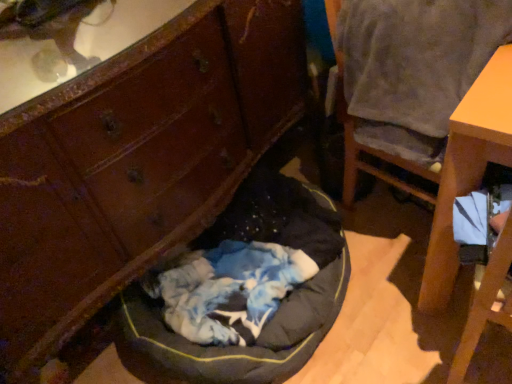
Question: Considering the relative sizes of dark gray fabric dog bed at center and wooden dresser at lower left in the image provided, is dark gray fabric dog bed at center thinner than wooden dresser at lower left?

Choices:
 (A) no
 (B) yes

Answer: (A)

Question: Can you confirm if dark gray fabric dog bed at center is bigger than wooden dresser at lower left?

Choices:
 (A) no
 (B) yes

Answer: (A)

Question: Is dark gray fabric dog bed at center in front of wooden dresser at lower left?

Choices:
 (A) yes
 (B) no

Answer: (B)

Question: From a real-world perspective, does dark gray fabric dog bed at center sit lower than wooden dresser at lower left?

Choices:
 (A) yes
 (B) no

Answer: (A)

Question: Is there a large distance between dark gray fabric dog bed at center and wooden dresser at lower left?

Choices:
 (A) yes
 (B) no

Answer: (B)

Question: Does point (343, 79) appear closer or farther from the camera than point (250, 221)?

Choices:
 (A) farther
 (B) closer

Answer: (B)

Question: Is gray fabric chair at upper right to the left or to the right of dark gray fabric dog bed at center in the image?

Choices:
 (A) left
 (B) right

Answer: (B)

Question: Is gray fabric chair at upper right bigger or smaller than dark gray fabric dog bed at center?

Choices:
 (A) big
 (B) small

Answer: (B)

Question: Which is correct: gray fabric chair at upper right is inside dark gray fabric dog bed at center, or outside of it?

Choices:
 (A) inside
 (B) outside

Answer: (B)

Question: From a real-world perspective, is dark gray fabric dog bed at center physically located above or below gray fabric chair at upper right?

Choices:
 (A) below
 (B) above

Answer: (A)

Question: Looking at their shapes, would you say dark gray fabric dog bed at center is wider or thinner than gray fabric chair at upper right?

Choices:
 (A) wide
 (B) thin

Answer: (A)

Question: Is dark gray fabric dog bed at center inside the boundaries of gray fabric chair at upper right, or outside?

Choices:
 (A) inside
 (B) outside

Answer: (B)

Question: Visually, is dark gray fabric dog bed at center positioned to the left or to the right of gray fabric chair at upper right?

Choices:
 (A) left
 (B) right

Answer: (A)

Question: From their relative heights in the image, would you say wooden dresser at lower left is taller or shorter than gray fabric chair at upper right?

Choices:
 (A) tall
 (B) short

Answer: (A)

Question: From the image's perspective, relative to gray fabric chair at upper right, is wooden dresser at lower left above or below?

Choices:
 (A) above
 (B) below

Answer: (B)